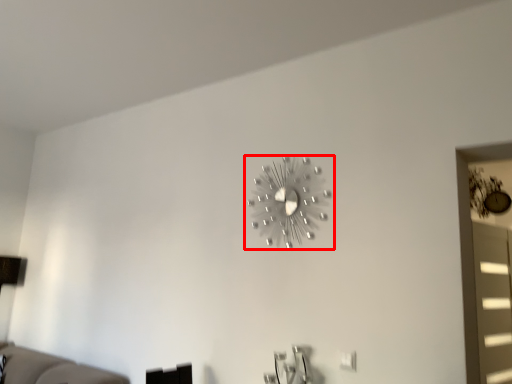
Question: From the image's perspective, what is the correct spatial relationship of wall clock (annotated by the red box) in relation to window?

Choices:
 (A) below
 (B) above

Answer: (B)